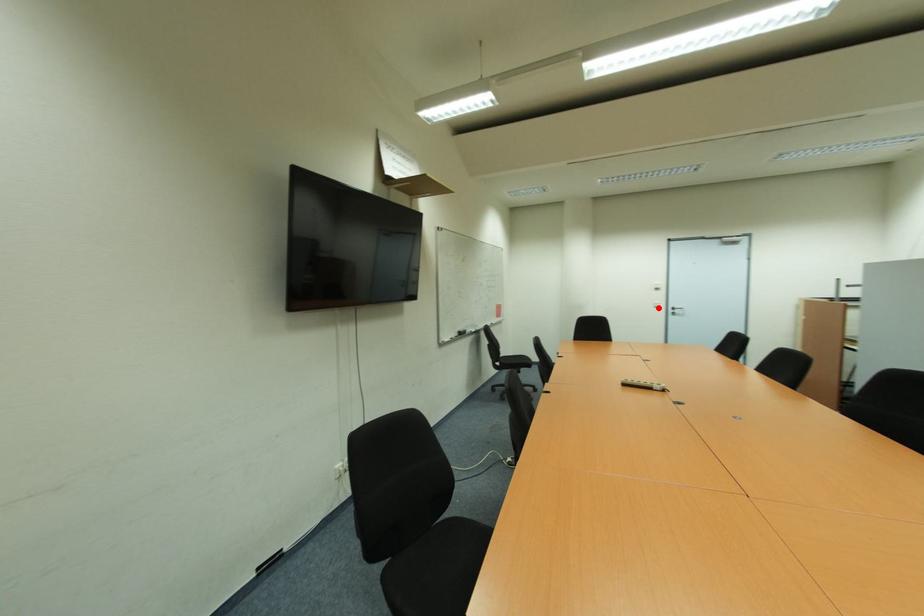
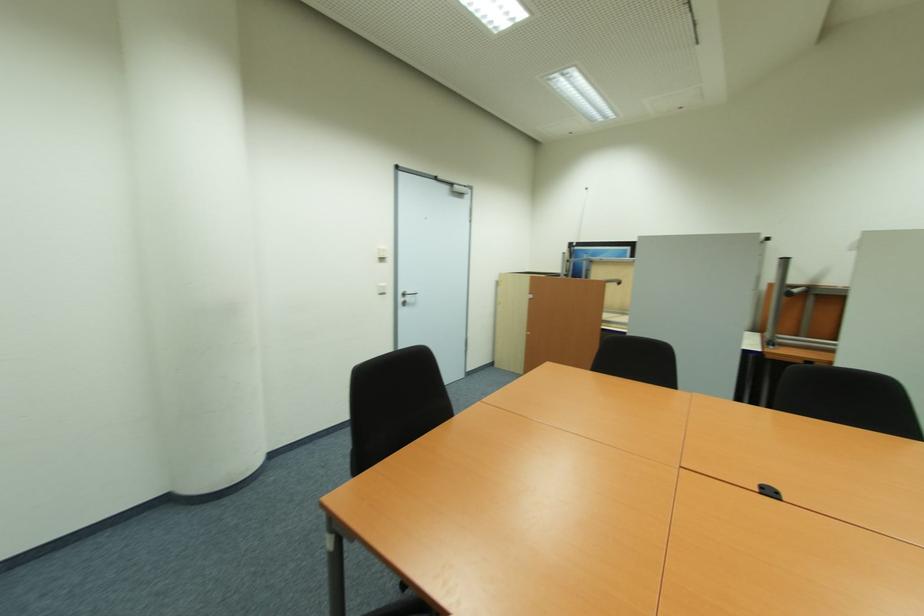
Locate, in the second image, the point that corresponds to the highlighted location in the first image.

(383, 294)